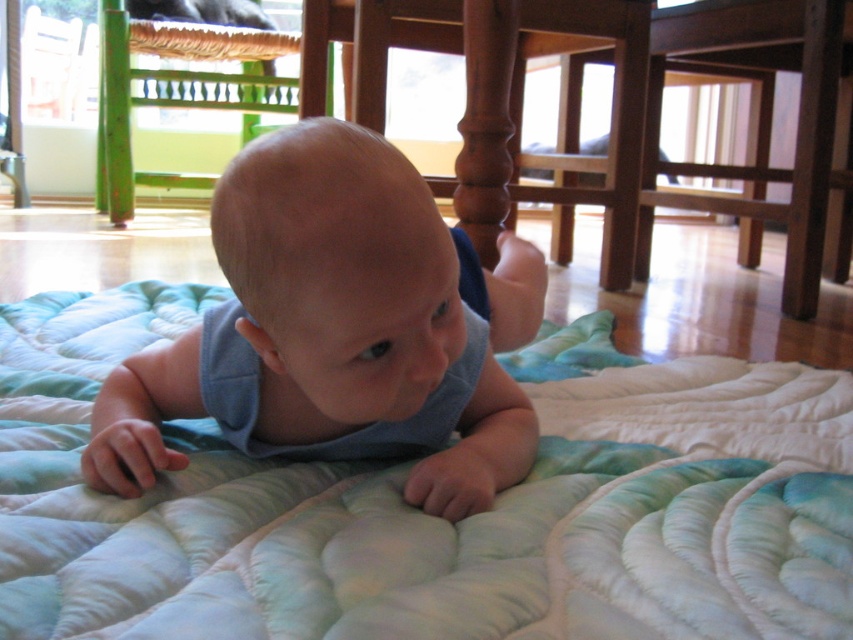
You are a parent trying to place a new toy on the wooden table in the background. The toy requires a minimum of 4 feet of space between the blue fabric baby at center and the wooden chair at center to be safely placed. Can you place the toy there?

The blue fabric baby at center is 3.52 feet from the wooden chair at center, which is less than the required 4 feet. Therefore, the toy cannot be safely placed there.

You are a parent trying to rearrange the nursery. You want to place a new toy box between the light blue quilt at center and the green wood chair at upper left. Based on their sizes, will the toy box fit in the space between them?

The light blue quilt at center occupies less space than the green wood chair at upper left, so the space between them may be sufficient for the toy box. However, since the exact dimensions of the toy box are not provided, it is recommended to measure the available space before placing the toy box.

You are a photographer trying to capture a closeup of the baby lying on its stomach on a quilted surface indoors. You are currently positioned at the camera location. The baby is at point (x=590, y=573). If you want to get a closer shot without moving the baby, how much closer can you move towards the baby?

The point (x=590, y=573) and camera are 24.98 inches apart from each other, so you can move up to 24.98 inches closer to the baby to get a closer shot without moving the baby.